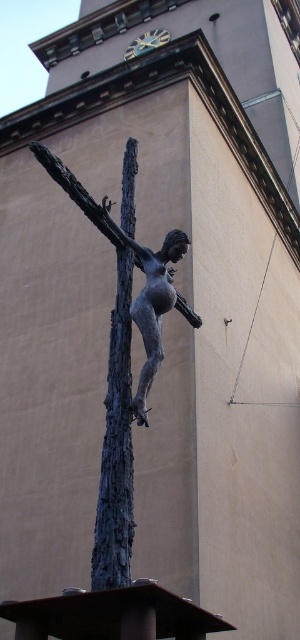
Question: Is bronze statue at center positioned at the back of bronze sculpture at center?

Choices:
 (A) no
 (B) yes

Answer: (B)

Question: Considering the relative positions of bronze statue at center and bronze sculpture at center in the image provided, where is bronze statue at center located with respect to bronze sculpture at center?

Choices:
 (A) left
 (B) right

Answer: (A)

Question: Which point is farther to the camera?

Choices:
 (A) bronze statue at center
 (B) bronze sculpture at center

Answer: (A)

Question: Which of the following is the farthest from the observer?

Choices:
 (A) bronze statue at center
 (B) bronze sculpture at center

Answer: (A)

Question: Can you confirm if bronze statue at center is positioned to the right of bronze sculpture at center?

Choices:
 (A) yes
 (B) no

Answer: (B)